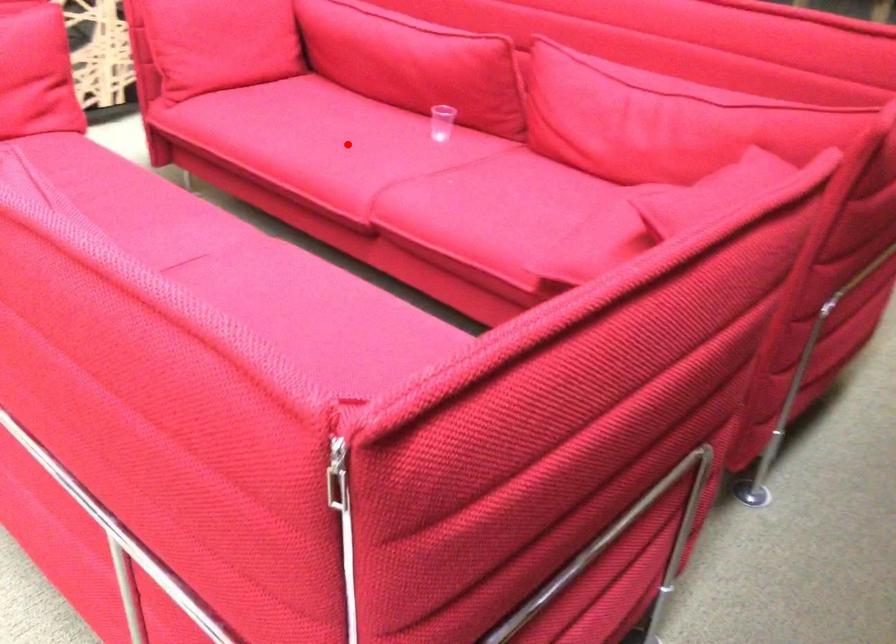
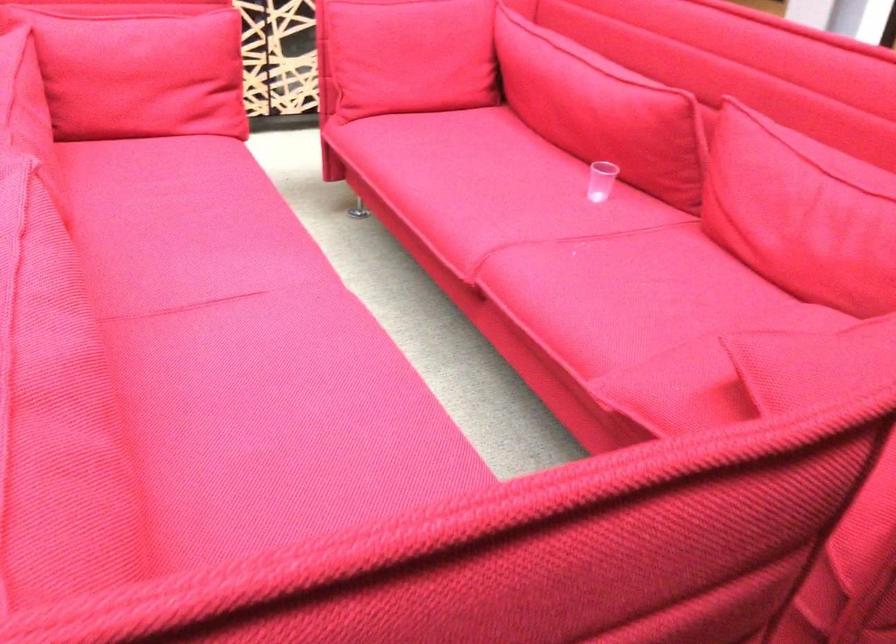
Question: I am providing you with two images of the same scene from different viewpoints. Image1 has a red point marked. In image2, the corresponding 3D location appears at what relative position? Reply with the corresponding letter.

Choices:
 (A) Closer
 (B) Farther

Answer: (A)